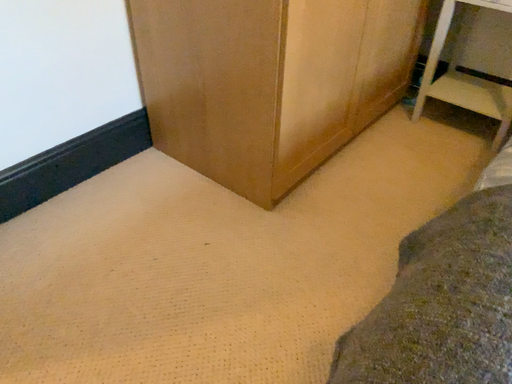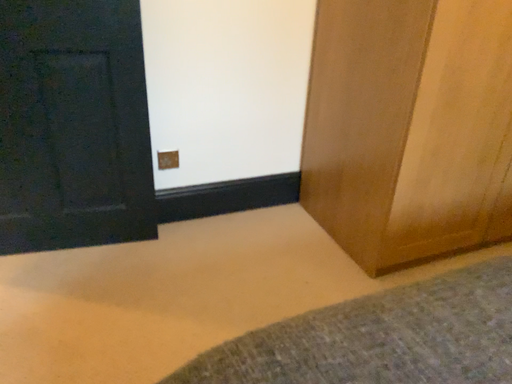
Question: How did the camera likely rotate when shooting the video?

Choices:
 (A) rotated right
 (B) rotated left

Answer: (B)